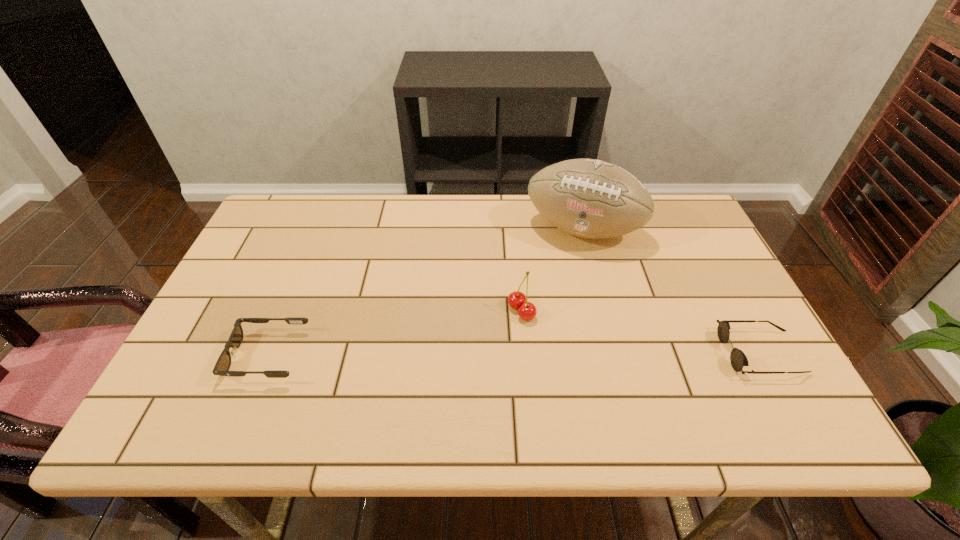
This screenshot has width=960, height=540. I want to click on the second closest object to the left sunglasses, so pyautogui.click(x=588, y=198).

At what (x,y) coordinates should I click in order to perform the action: click on free space that satisfies the following two spatial constraints: 1. on the front side of the rightmost object; 2. on the front-facing side of the farthest object. Please return your answer as a coordinate pair (x, y). Looking at the image, I should click on (615, 353).